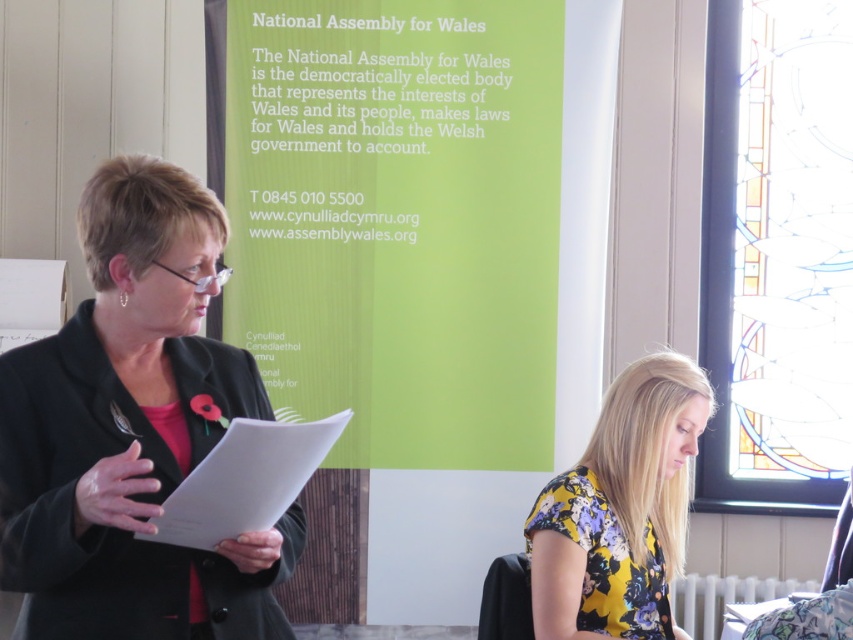
Question: Is black matte blazer at left to the right of white paper clipboard at center from the viewer's perspective?

Choices:
 (A) yes
 (B) no

Answer: (B)

Question: Which object is closer to the camera taking this photo?

Choices:
 (A) floral fabric blouse at lower center
 (B) black matte blazer at left

Answer: (B)

Question: Can you confirm if black matte blazer at left is bigger than white paper clipboard at center?

Choices:
 (A) yes
 (B) no

Answer: (A)

Question: Does black matte blazer at left appear on the right side of white paper clipboard at center?

Choices:
 (A) no
 (B) yes

Answer: (A)

Question: Which object is closer to the camera taking this photo?

Choices:
 (A) black matte blazer at left
 (B) floral fabric blouse at lower center

Answer: (A)

Question: Among these objects, which one is farthest from the camera?

Choices:
 (A) black matte blazer at left
 (B) floral fabric blouse at lower center
 (C) white paper clipboard at center

Answer: (B)